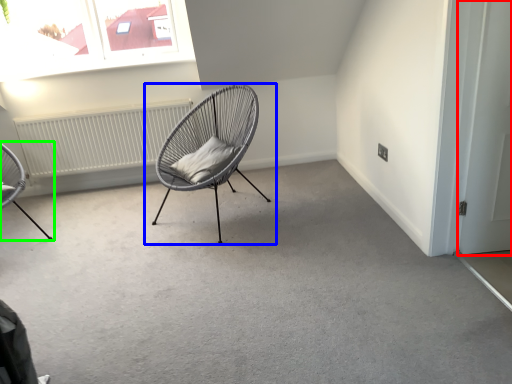
Question: Based on their relative distances, which object is farther from door (highlighted by a red box)? Choose from chair (highlighted by a blue box) and chair (highlighted by a green box).

Choices:
 (A) chair
 (B) chair

Answer: (B)